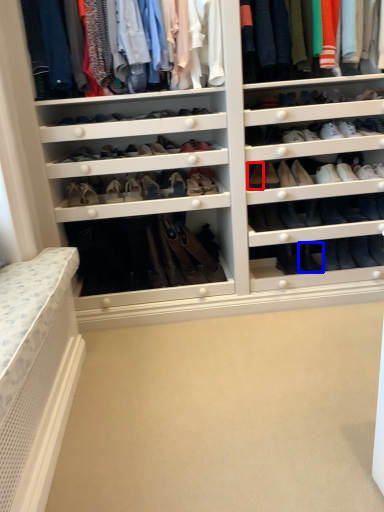
Question: Which object appears farthest to the camera in this image, shoe (highlighted by a red box) or shoe (highlighted by a blue box)?

Choices:
 (A) shoe
 (B) shoe

Answer: (B)